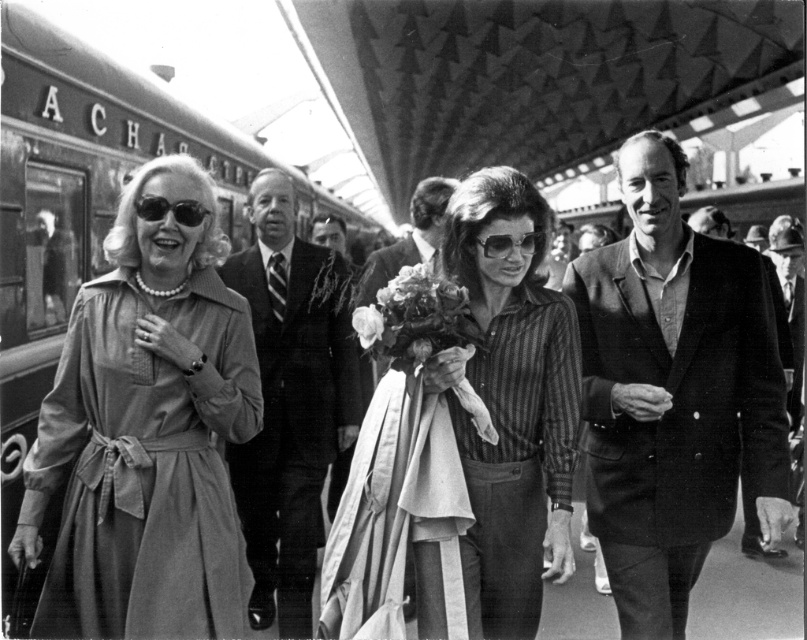
You are a photographer standing at the center of the train platform. You want to capture a closeup shot of the soft white petals at center. Based on their position, where should you aim your camera?

The soft white petals at center are located at point coordinates of 0.495 on the x axis and 0.517 on the y axis, so you should aim your camera precisely at those coordinates to capture them in focus.

You are an observer standing on the train platform looking at the group of people. Which object is positioned higher relative to the other between the striped fabric shirt at center and the matte black sunglasses at center?

The striped fabric shirt at center is much taller than the matte black sunglasses at center, so the striped fabric shirt at center is positioned higher relative to the matte black sunglasses at center.